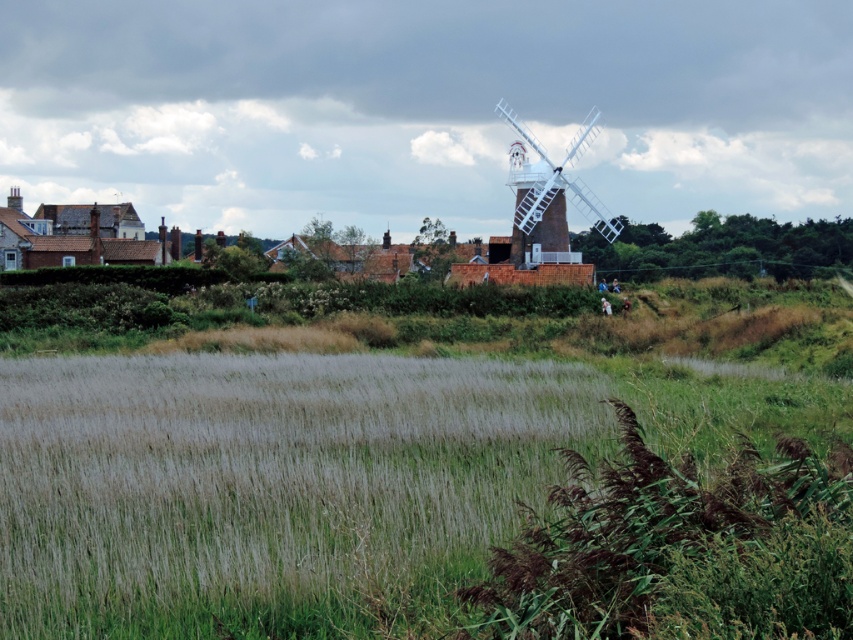
Question: Is brown fuzzy plant at lower right bigger than white wooden windmill at center?

Choices:
 (A) yes
 (B) no

Answer: (B)

Question: Which of these objects is positioned closest to the brown fuzzy plant at lower right?

Choices:
 (A) green grassy rice field at lower left
 (B) white wooden windmill at center

Answer: (A)

Question: Does green grassy rice field at lower left appear under white wooden windmill at center?

Choices:
 (A) yes
 (B) no

Answer: (A)

Question: Does green grassy rice field at lower left have a lesser width compared to brown fuzzy plant at lower right?

Choices:
 (A) yes
 (B) no

Answer: (B)

Question: Which object appears closest to the camera in this image?

Choices:
 (A) brown fuzzy plant at lower right
 (B) green grassy rice field at lower left

Answer: (A)

Question: Which of the following is the closest to the observer?

Choices:
 (A) (830, 572)
 (B) (538, 141)
 (C) (521, 456)

Answer: (A)